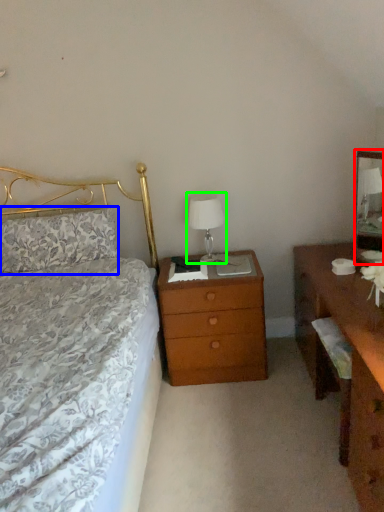
Question: Estimate the real-world distances between objects in this image. Which object is closer to mirror (highlighted by a red box), pillow (highlighted by a blue box) or bedside lamp (highlighted by a green box)?

Choices:
 (A) pillow
 (B) bedside lamp

Answer: (B)